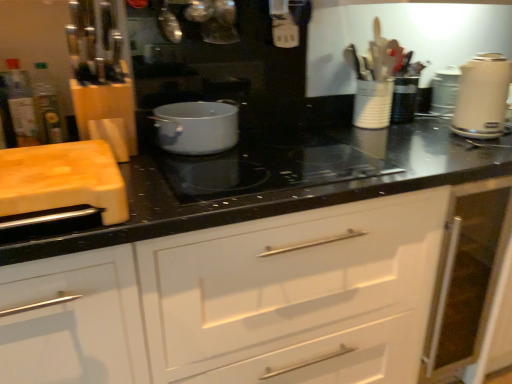
Question: Is white glossy electric kettle at right, the 1th kitchen appliance positioned from the right, further to camera compared to translucent glass bottle at left, the 2th bottle in the left-to-right sequence?

Choices:
 (A) no
 (B) yes

Answer: (B)

Question: Does white glossy electric kettle at right, the 1th kitchen appliance positioned from the right, have a smaller size compared to translucent glass bottle at left, the 2th bottle in the left-to-right sequence?

Choices:
 (A) no
 (B) yes

Answer: (A)

Question: Is white glossy electric kettle at right, the 1th kitchen appliance positioned from the right, thinner than translucent glass bottle at left, placed as the 1th bottle when sorted from right to left?

Choices:
 (A) yes
 (B) no

Answer: (B)

Question: From a real-world perspective, is white glossy electric kettle at right, which appears as the 2th kitchen appliance when viewed from the left, positioned over translucent glass bottle at left, the 2th bottle in the left-to-right sequence, based on gravity?

Choices:
 (A) yes
 (B) no

Answer: (B)

Question: Is white glossy electric kettle at right, the 1th kitchen appliance positioned from the right, directly adjacent to translucent glass bottle at left, placed as the 1th bottle when sorted from right to left?

Choices:
 (A) no
 (B) yes

Answer: (A)

Question: From the image's perspective, is white glossy electric kettle at right, which appears as the 2th kitchen appliance when viewed from the left, located beneath translucent glass bottle at left, placed as the 1th bottle when sorted from right to left?

Choices:
 (A) no
 (B) yes

Answer: (A)

Question: Can you confirm if metallic silver kettle at upper center, positioned as the third appliance in back-to-front order, is bigger than wooden cutting board at left?

Choices:
 (A) no
 (B) yes

Answer: (A)

Question: Is metallic silver kettle at upper center, positioned as the 1th appliance in front-to-back order, at the left side of wooden cutting board at left?

Choices:
 (A) yes
 (B) no

Answer: (B)

Question: Considering the relative sizes of metallic silver kettle at upper center, arranged as the third appliance when viewed from the right, and wooden cutting board at left in the image provided, is metallic silver kettle at upper center, arranged as the third appliance when viewed from the right, wider than wooden cutting board at left?

Choices:
 (A) no
 (B) yes

Answer: (A)

Question: Is metallic silver kettle at upper center, arranged as the third appliance when viewed from the right, not close to wooden cutting board at left?

Choices:
 (A) yes
 (B) no

Answer: (B)

Question: Does metallic silver kettle at upper center, positioned as the 1th appliance in front-to-back order, touch wooden cutting board at left?

Choices:
 (A) no
 (B) yes

Answer: (A)

Question: Is metallic silver kettle at upper center, arranged as the third appliance when viewed from the right, positioned before wooden cutting board at left?

Choices:
 (A) no
 (B) yes

Answer: (A)

Question: From a real-world perspective, is translucent plastic bottle at left, arranged as the 2th bottle when viewed from the right, physically above translucent glass bottle at left, placed as the 1th bottle when sorted from right to left?

Choices:
 (A) yes
 (B) no

Answer: (A)